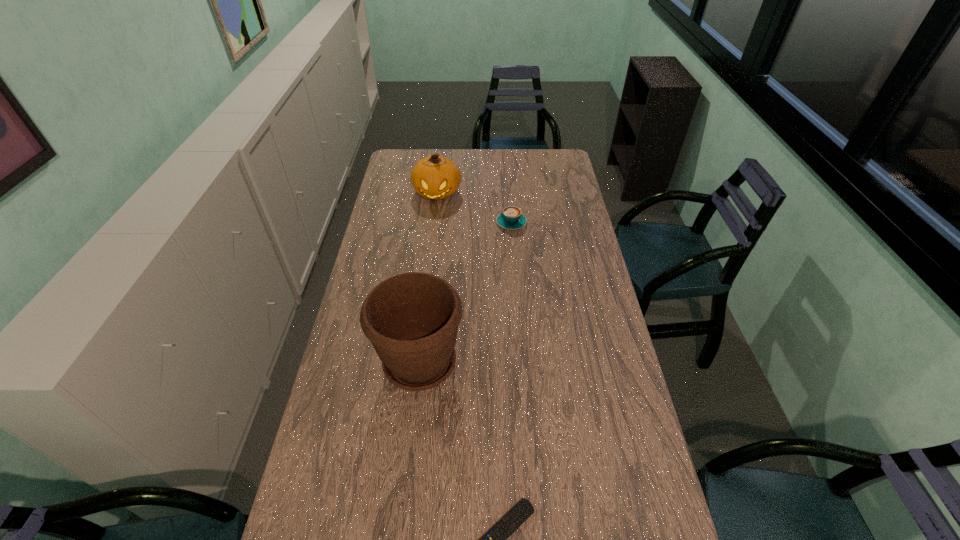
Find the location of `vacant space located with the handle on the right side of the third nearest object`. vacant space located with the handle on the right side of the third nearest object is located at coordinates (507, 171).

Find the location of a particular element. This screenshot has width=960, height=540. flowerpot that is positioned at the left edge is located at coordinates (411, 319).

The height and width of the screenshot is (540, 960). Find the location of `pumpkin that is at the left edge`. pumpkin that is at the left edge is located at coordinates (435, 177).

Where is `vacant space at the far edge of the desktop`? Image resolution: width=960 pixels, height=540 pixels. vacant space at the far edge of the desktop is located at coordinates (449, 149).

Locate an element on the screen. The width and height of the screenshot is (960, 540). free space at the left edge of the desktop is located at coordinates (407, 246).

In the image, there is a desktop. Where is `free space at the right edge`? free space at the right edge is located at coordinates point(558,194).

Identify the location of vacant space at the far right corner. Image resolution: width=960 pixels, height=540 pixels. (557, 151).

The image size is (960, 540). I want to click on free space between the flowerpot and the second shortest object, so pyautogui.click(x=466, y=293).

You are a GUI agent. You are given a task and a screenshot of the screen. Output one action in this format:
    pyautogui.click(x=<x>, y=<y>)
    Task: Click on the free space between the second farthest object and the flowerpot
    The height and width of the screenshot is (540, 960).
    Given the screenshot: What is the action you would take?
    pyautogui.click(x=466, y=293)

You are a GUI agent. You are given a task and a screenshot of the screen. Output one action in this format:
    pyautogui.click(x=<x>, y=<y>)
    Task: Click on the empty location between the second farthest object and the second nearest object
    Image resolution: width=960 pixels, height=540 pixels.
    Given the screenshot: What is the action you would take?
    pyautogui.click(x=466, y=293)